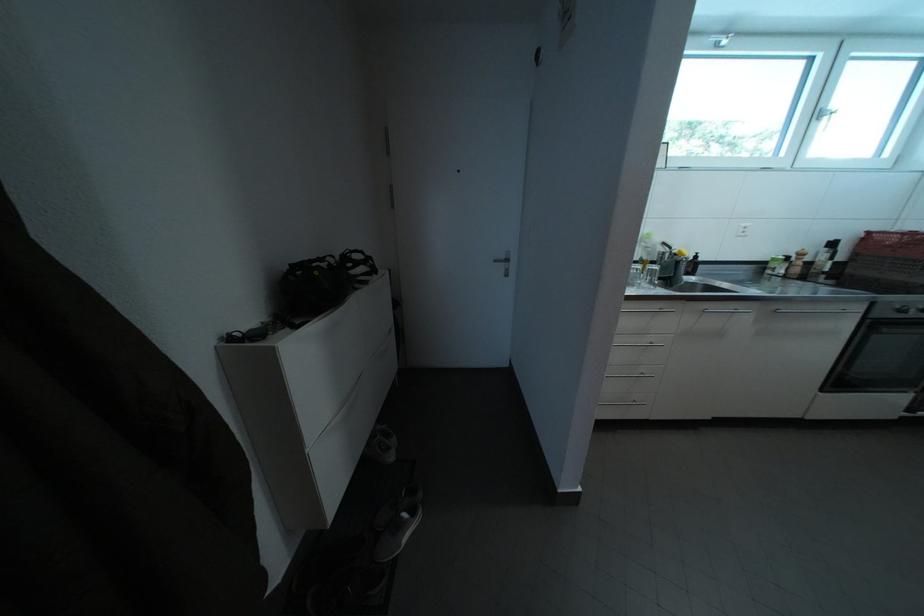
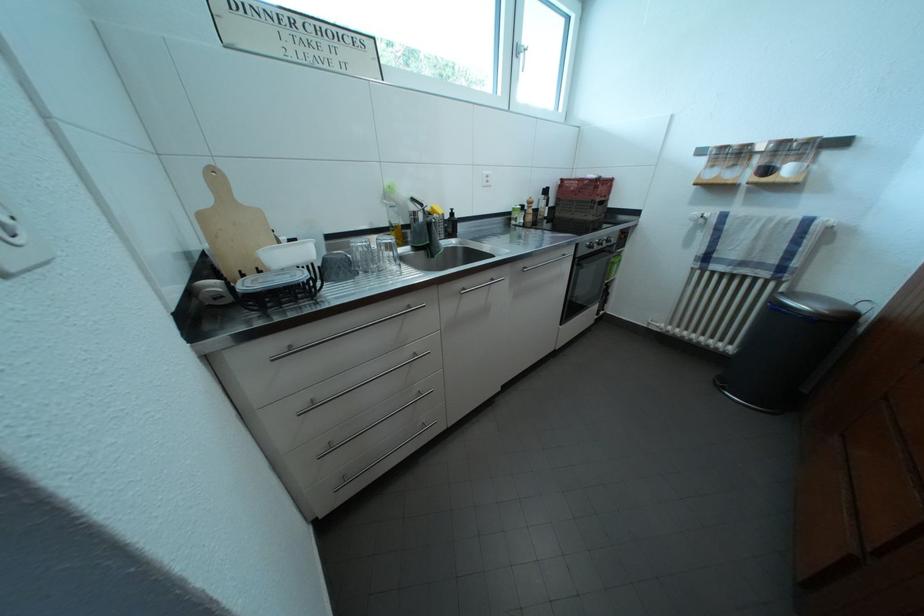
Find the pixel in the second image that matches (x=825, y=121) in the first image.

(525, 55)